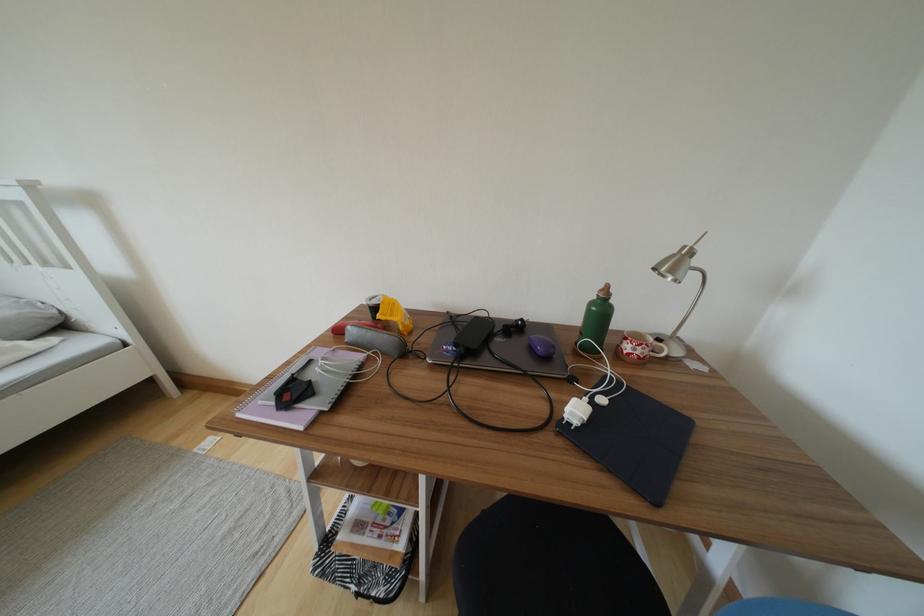
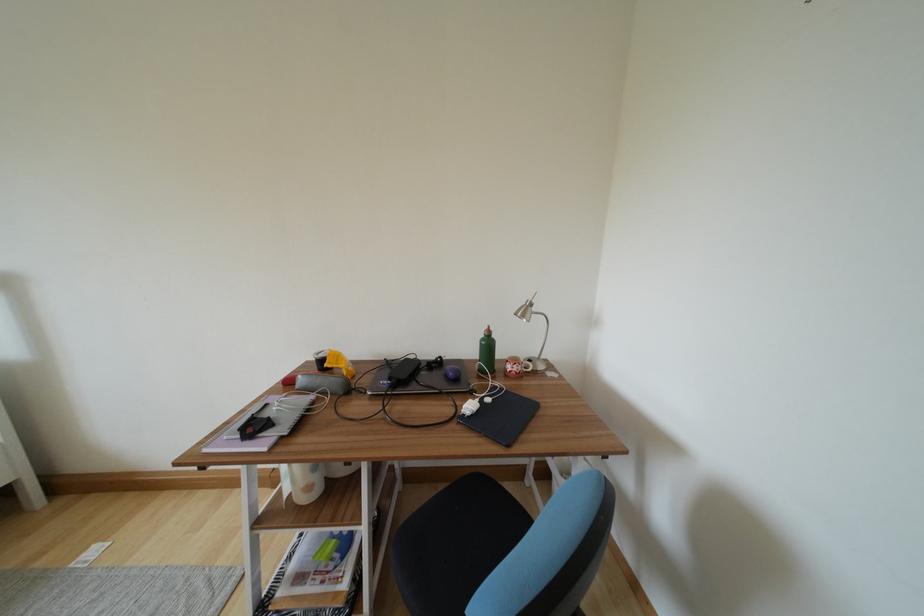
The point at (x=357, y=336) is marked in the first image. Where is the corresponding point in the second image?

(306, 385)